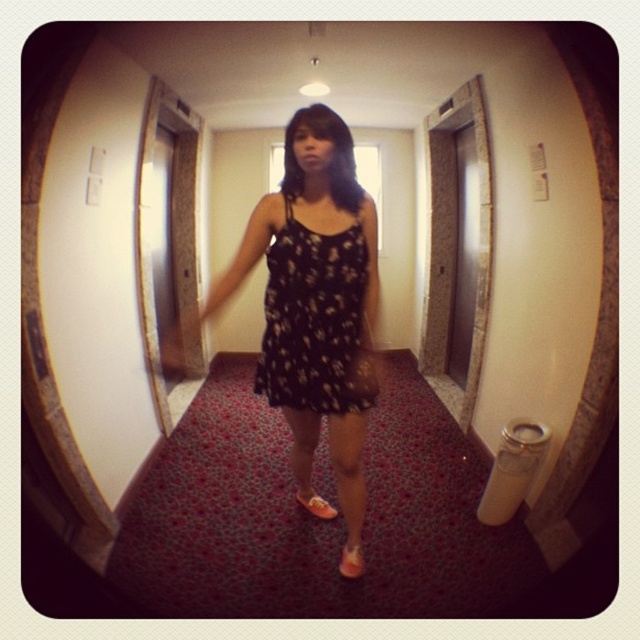
Which is above, floral-patterned fabric dress at center or orange fabric sandal at lower center?

floral-patterned fabric dress at center is above.

Is floral-patterned fabric dress at center shorter than orange fabric sandal at lower center?

Incorrect, floral-patterned fabric dress at center's height does not fall short of orange fabric sandal at lower center's.

Which is behind, point (330, 406) or point (355, 550)?

Point (355, 550)

Locate an element on the screen. This screenshot has width=640, height=640. floral-patterned fabric dress at center is located at coordinates (314, 321).

Does point (349, 552) lie in front of point (323, 500)?

That is True.

Between orange fabric sandal at lower center and orange suede sandal at center, which one appears on the left side from the viewer's perspective?

From the viewer's perspective, orange suede sandal at center appears more on the left side.

Is point (348, 563) positioned after point (323, 512)?

No, (348, 563) is closer to viewer.

Where is `orange fabric sandal at lower center`? The height and width of the screenshot is (640, 640). orange fabric sandal at lower center is located at coordinates (352, 561).

Between floral-patterned fabric dress at center and orange suede sandal at center, which one is positioned higher?

floral-patterned fabric dress at center is higher up.

In the scene shown: Is floral-patterned fabric dress at center further to camera compared to orange suede sandal at center?

No.

Looking at this image, who is more distant from viewer, (x=291, y=385) or (x=317, y=506)?

Point (x=317, y=506)

Find the location of `floral-patterned fabric dress at center`. floral-patterned fabric dress at center is located at coordinates (314, 321).